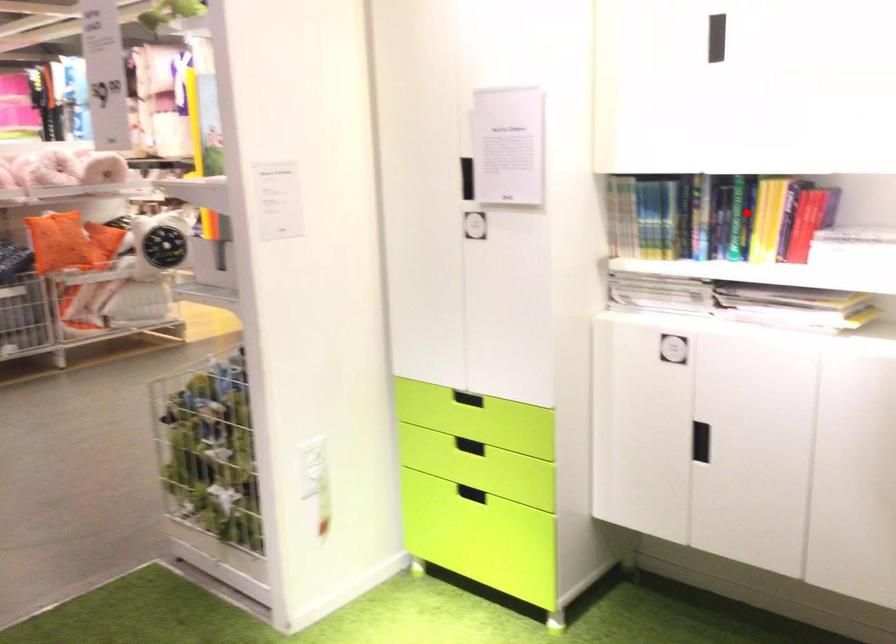
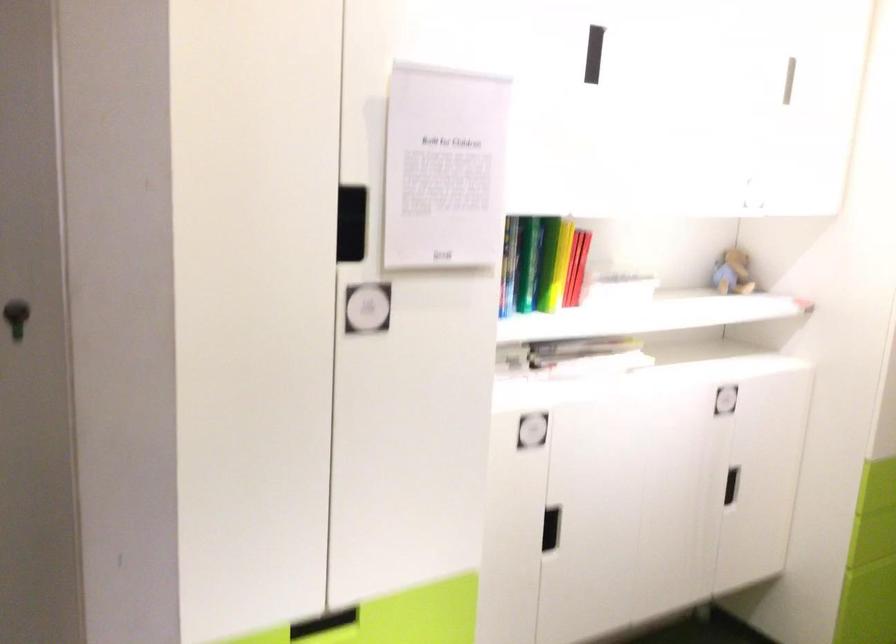
Question: I am providing you with two images of the same scene from different viewpoints. A red point is marked on the first image. Can you still see the location of the red point in image 2?

Choices:
 (A) Yes
 (B) No

Answer: (A)